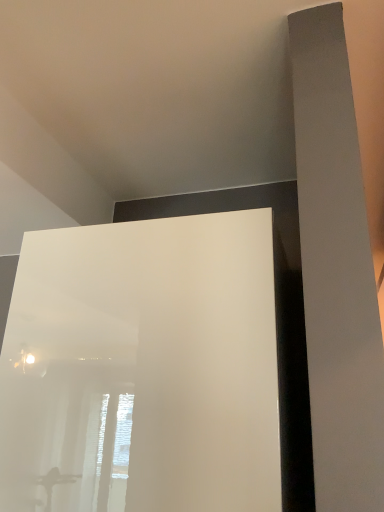
What do you see at coordinates (276, 314) in the screenshot?
I see `white glossy board at center` at bounding box center [276, 314].

Identify the location of white glossy board at center. (276, 314).

This screenshot has height=512, width=384. I want to click on white glossy board at center, so click(276, 314).